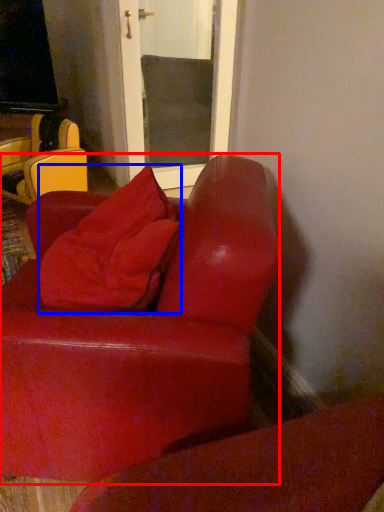
Question: Among these objects, which one is nearest to the camera, studio couch (highlighted by a red box) or throw pillow (highlighted by a blue box)?

Choices:
 (A) studio couch
 (B) throw pillow

Answer: (A)